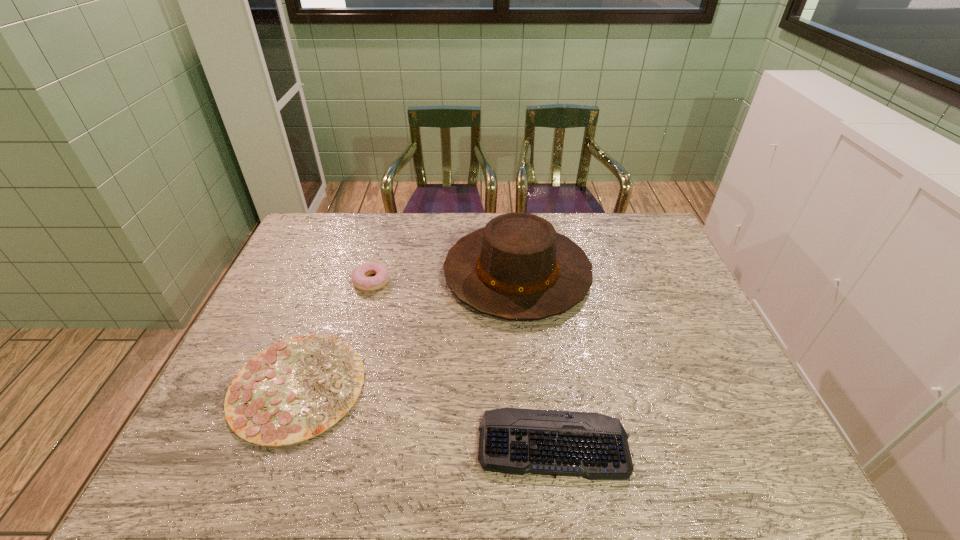
You are a GUI agent. You are given a task and a screenshot of the screen. Output one action in this format:
    pyautogui.click(x=<x>, y=<y>)
    Task: Click on the empty location between the computer keyboard and the second shortest object
    
    Given the screenshot: What is the action you would take?
    pyautogui.click(x=425, y=414)

Where is `blank region between the tallest object and the pizza`? The width and height of the screenshot is (960, 540). blank region between the tallest object and the pizza is located at coordinates (407, 329).

You are a GUI agent. You are given a task and a screenshot of the screen. Output one action in this format:
    pyautogui.click(x=<x>, y=<y>)
    Task: Click on the vacant area that lies between the pizza and the tallest object
    
    Given the screenshot: What is the action you would take?
    pyautogui.click(x=407, y=329)

At what (x,y) coordinates should I click in order to perform the action: click on free space between the tallest object and the second tallest object. Please return your answer as a coordinate pair (x, y). This screenshot has height=540, width=960. Looking at the image, I should click on (444, 277).

Where is `vacant space that is in between the third tallest object and the shortest object`? Image resolution: width=960 pixels, height=540 pixels. vacant space that is in between the third tallest object and the shortest object is located at coordinates (425, 414).

In order to click on free space between the second tallest object and the second shortest object in this screenshot , I will do `click(335, 333)`.

I want to click on free space between the doughnut and the shortest object, so click(x=463, y=362).

Identify the location of the third closest object relative to the tallest object. (516, 441).

Locate an element on the screen. The width and height of the screenshot is (960, 540). the second closest object to the shortest object is located at coordinates (296, 389).

The image size is (960, 540). What are the coordinates of `free point that satisfies the following two spatial constraints: 1. on the back side of the third tallest object; 2. on the left side of the doughnut` in the screenshot? It's located at (336, 281).